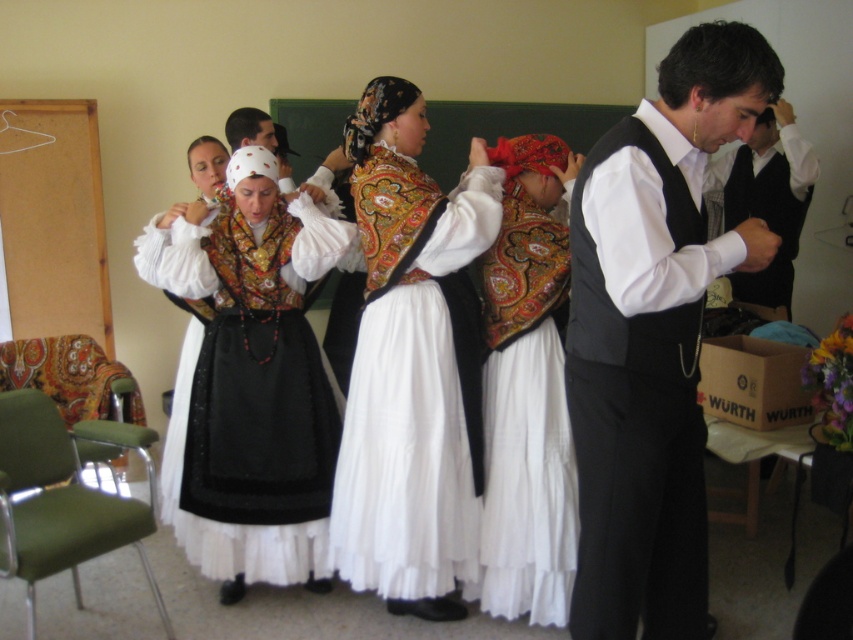
Consider the image. You are standing in the room and see both the black satin vest at center and the white shirt at center. Which one do you see first when looking towards the center of the room?

The black satin vest at center is closer to the viewer than the white shirt at center, so you would see the black satin vest at center first when looking towards the center of the room.